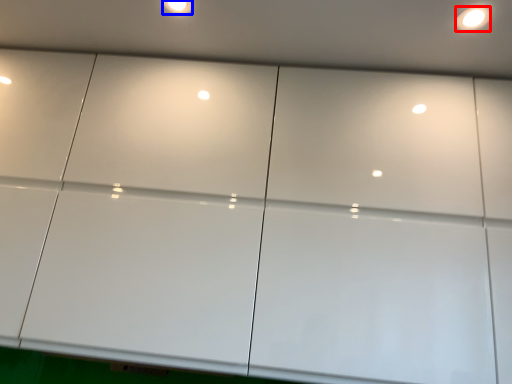
Question: Which point is further to the camera, light (highlighted by a red box) or dot (highlighted by a blue box)?

Choices:
 (A) light
 (B) dot

Answer: (B)